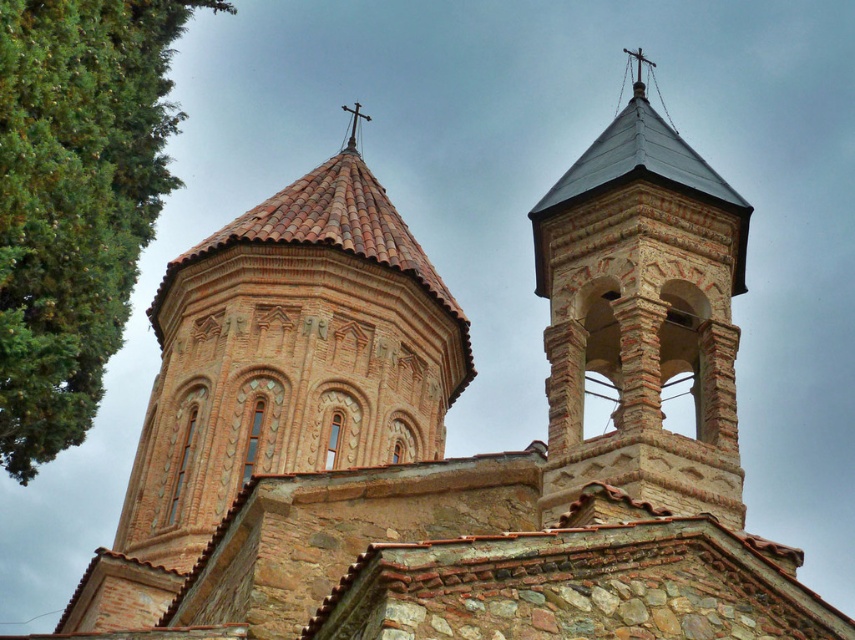
You are standing in front of the historic stone church and notice two points marked on the towers. Which point, point (83, 401) or point (640, 419), is closer to you?

Point (83, 401) is closer to you because it is further to the viewer than point (640, 419).

You are standing in front of the church and want to take a photo that includes both the green leafy tree at left and the brown stone bell tower at upper right. Which object will appear larger in the photo?

The green leafy tree at left will appear larger in the photo because it is taller than the brown stone bell tower at upper right.